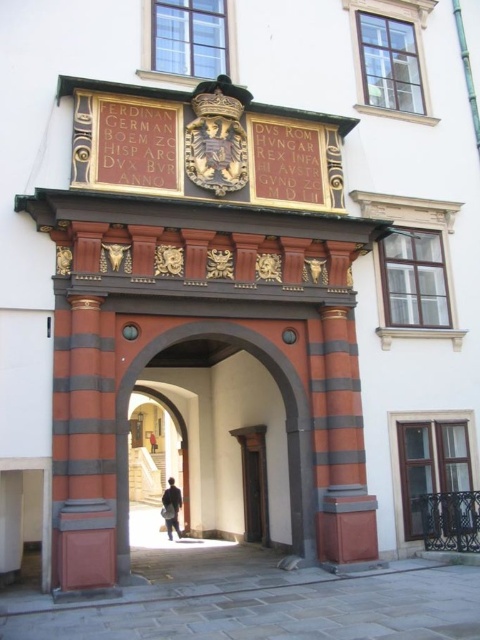
Does matte wood door at center appear on the left side of dark brown leather jacket at center?

Incorrect, matte wood door at center is not on the left side of dark brown leather jacket at center.

Can you confirm if matte wood door at center is thinner than dark brown leather jacket at center?

Indeed, matte wood door at center has a lesser width compared to dark brown leather jacket at center.

Between point (260, 477) and point (171, 515), which one is positioned in front?

Point (260, 477) is more forward.

Locate an element on the screen. The height and width of the screenshot is (640, 480). matte wood door at center is located at coordinates (252, 493).

Is matte wood door at center taller than dark blue jacket at center?

No.

I want to click on matte wood door at center, so click(x=252, y=493).

Does point (257, 518) come farther from viewer compared to point (154, 451)?

No, it is in front of (154, 451).

Find the location of a particular element. The image size is (480, 640). matte wood door at center is located at coordinates (252, 493).

Where is `smooth wood door at center`? This screenshot has height=640, width=480. smooth wood door at center is located at coordinates (285, 424).

This screenshot has height=640, width=480. What do you see at coordinates (285, 424) in the screenshot?
I see `smooth wood door at center` at bounding box center [285, 424].

Where is `smooth wood door at center`? The image size is (480, 640). smooth wood door at center is located at coordinates (285, 424).